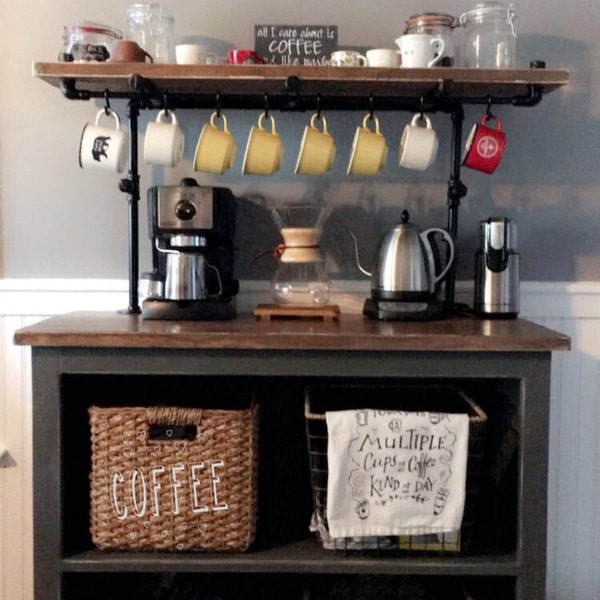
You are a GUI agent. You are given a task and a screenshot of the screen. Output one action in this format:
    pyautogui.click(x=<x>, y=<y>)
    Task: Click on the weaved basket
    
    Given the screenshot: What is the action you would take?
    pyautogui.click(x=136, y=457)